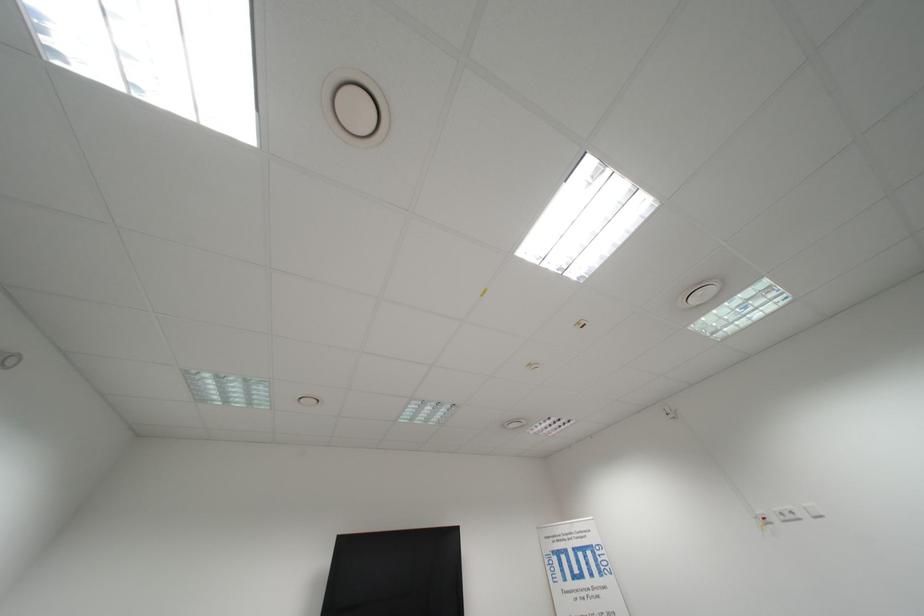
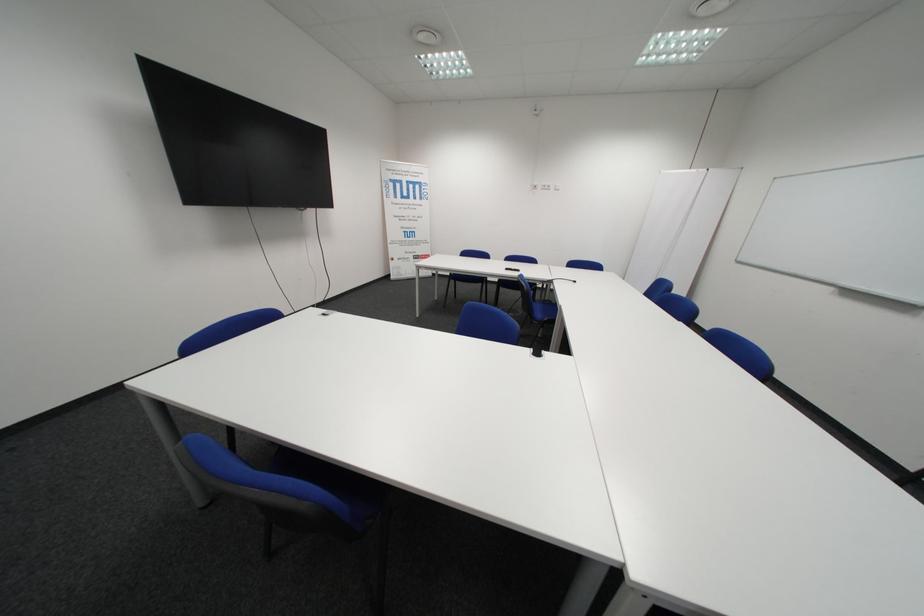
Locate, in the second image, the point that corresponds to [796,519] in the first image.

(554, 188)